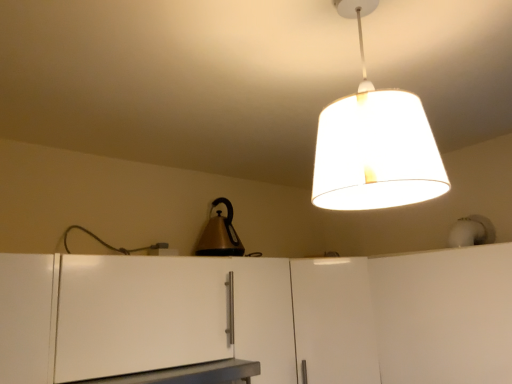
Question: Is the position of metallic gray table at lower center less distant than that of white matte cabinet at center, placed as the second cabinetry when sorted from left to right?

Choices:
 (A) no
 (B) yes

Answer: (B)

Question: Is metallic gray table at lower center smaller than white matte cabinet at center, the 2th cabinetry positioned from the right?

Choices:
 (A) no
 (B) yes

Answer: (B)

Question: Can you confirm if metallic gray table at lower center is bigger than white matte cabinet at center, placed as the second cabinetry when sorted from left to right?

Choices:
 (A) yes
 (B) no

Answer: (B)

Question: Is metallic gray table at lower center at the right side of white matte cabinet at center, the 2th cabinetry positioned from the right?

Choices:
 (A) no
 (B) yes

Answer: (A)

Question: Is metallic gray table at lower center to the left of white matte cabinet at center, placed as the second cabinetry when sorted from left to right, from the viewer's perspective?

Choices:
 (A) no
 (B) yes

Answer: (B)

Question: From the image's perspective, is metallic gray table at lower center located beneath white matte cabinet at center, placed as the second cabinetry when sorted from left to right?

Choices:
 (A) no
 (B) yes

Answer: (A)

Question: Would you say white matte cabinet at lower right, the third cabinetry viewed from the left, is part of metallic gold kettle at center's contents?

Choices:
 (A) no
 (B) yes

Answer: (A)

Question: Can you confirm if metallic gold kettle at center is taller than white matte cabinet at lower right, the third cabinetry viewed from the left?

Choices:
 (A) yes
 (B) no

Answer: (B)

Question: From the image's perspective, does metallic gold kettle at center appear higher than white matte cabinet at lower right, the third cabinetry viewed from the left?

Choices:
 (A) no
 (B) yes

Answer: (B)

Question: Does metallic gold kettle at center have a greater width compared to white matte cabinet at lower right, acting as the 1th cabinetry starting from the right?

Choices:
 (A) yes
 (B) no

Answer: (B)

Question: From a real-world perspective, is metallic gold kettle at center on white matte cabinet at lower right, acting as the 1th cabinetry starting from the right?

Choices:
 (A) yes
 (B) no

Answer: (A)

Question: From the image's perspective, is metallic gold kettle at center beneath white matte cabinet at lower right, acting as the 1th cabinetry starting from the right?

Choices:
 (A) no
 (B) yes

Answer: (A)

Question: From the image's perspective, does metallic gold kettle at center appear higher than white fabric lampshade at upper center?

Choices:
 (A) yes
 (B) no

Answer: (B)